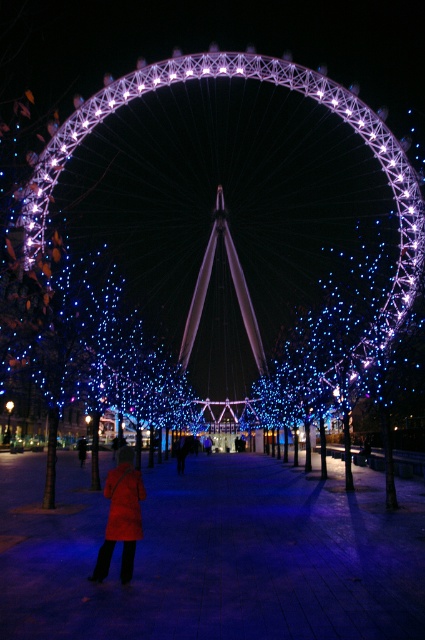
Question: Which object is closer to the camera taking this photo?

Choices:
 (A) red wool coat at center
 (B) illuminated steel ferris wheel at center

Answer: (A)

Question: Which of the following is the closest to the observer?

Choices:
 (A) illuminated steel ferris wheel at center
 (B) red wool coat at center

Answer: (B)

Question: Can you confirm if illuminated steel ferris wheel at center is positioned below red wool coat at center?

Choices:
 (A) yes
 (B) no

Answer: (B)

Question: Is illuminated steel ferris wheel at center behind red wool coat at center?

Choices:
 (A) no
 (B) yes

Answer: (B)

Question: Does illuminated steel ferris wheel at center appear on the left side of red wool coat at center?

Choices:
 (A) no
 (B) yes

Answer: (A)

Question: Which object appears closest to the camera in this image?

Choices:
 (A) illuminated steel ferris wheel at center
 (B) red wool coat at center

Answer: (B)